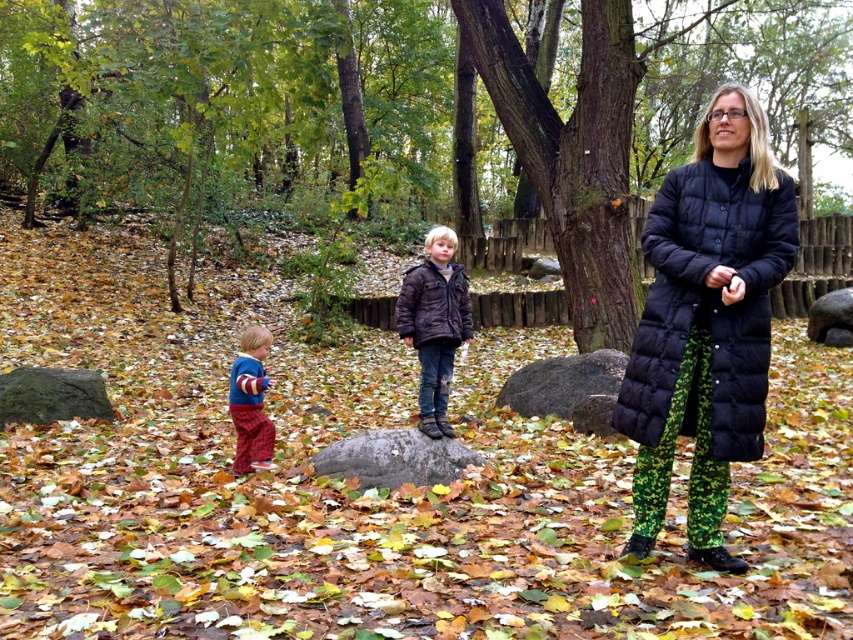
Looking at this image, is brown textured bark at center bigger than gray rough stone at center?

Correct, brown textured bark at center is larger in size than gray rough stone at center.

Is the position of brown textured bark at center more distant than that of gray rough stone at center?

That is True.

Identify the location of brown textured bark at center. click(572, 154).

The height and width of the screenshot is (640, 853). I want to click on brown textured bark at center, so click(572, 154).

Does black puffer coat at right have a larger size compared to green mossy rock at lower left?

Correct, black puffer coat at right is larger in size than green mossy rock at lower left.

Between point (641, 358) and point (38, 404), which one is positioned behind?

The point (38, 404) is more distant.

Where is `black puffer coat at right`? This screenshot has width=853, height=640. black puffer coat at right is located at coordinates (706, 321).

Who is positioned more to the right, gray rough stone at center or plaid fabric pants at lower left?

From the viewer's perspective, gray rough stone at center appears more on the right side.

The height and width of the screenshot is (640, 853). What are the coordinates of `gray rough stone at center` in the screenshot? It's located at (395, 458).

Is point (445, 474) more distant than point (264, 349)?

No, it is not.

This screenshot has width=853, height=640. Identify the location of gray rough stone at center. (395, 458).